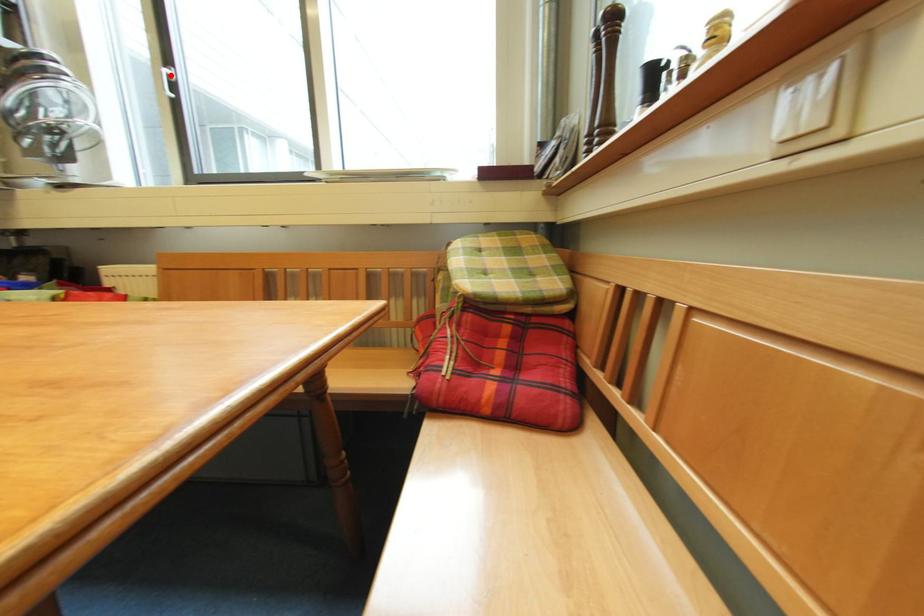
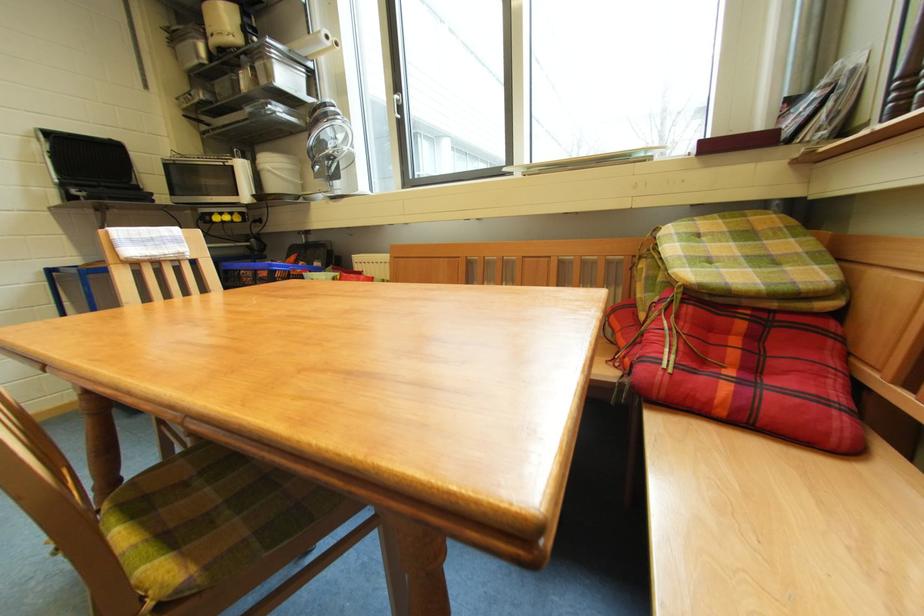
Question: I am providing you with two images of the same scene from different viewpoints. In image1, a red point is highlighted. Considering the same 3D point in image2, which of the following is correct?

Choices:
 (A) It is closer
 (B) It is farther

Answer: (A)